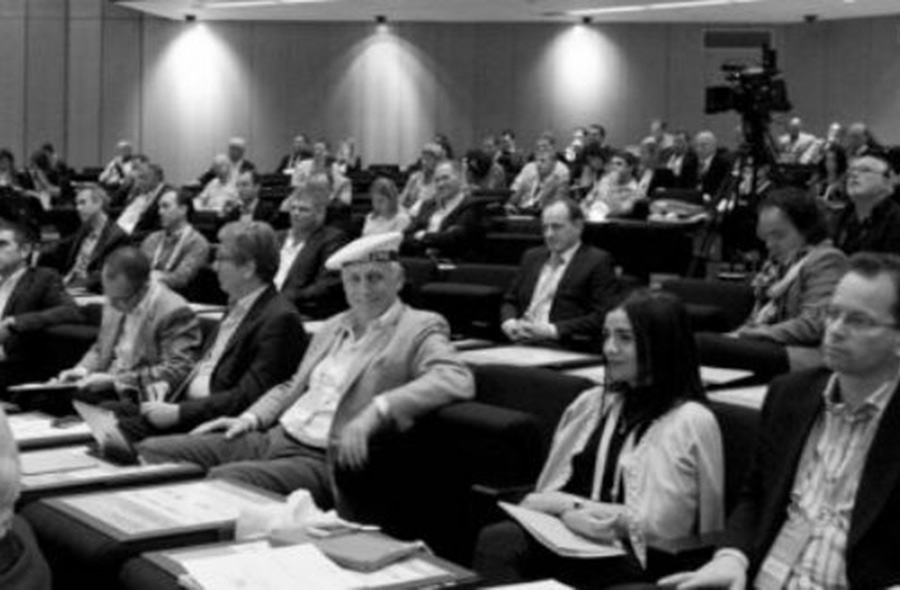
Locate an element on the screen. black seating is located at coordinates (534, 388).